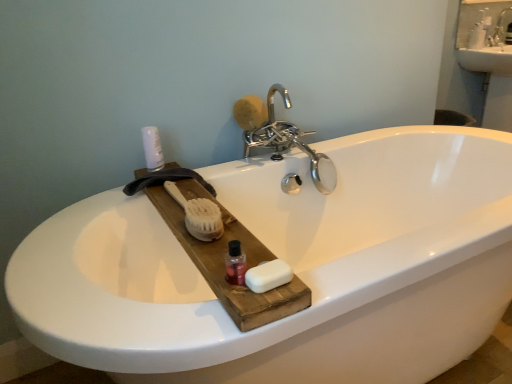
You are a GUI agent. You are given a task and a screenshot of the screen. Output one action in this format:
    pyautogui.click(x=<x>, y=<y>)
    Task: Click on the free space behind translucent plastic bottle at center
    
    Given the screenshot: What is the action you would take?
    pyautogui.click(x=225, y=243)